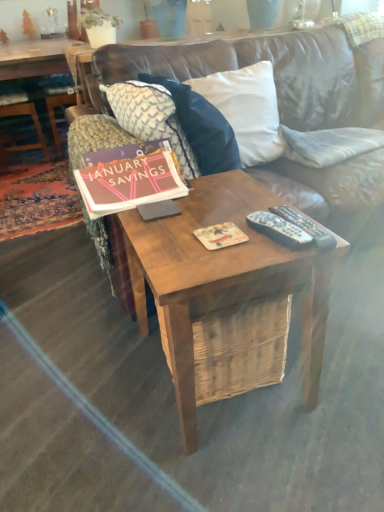
This screenshot has width=384, height=512. What do you see at coordinates (240, 348) in the screenshot?
I see `woven brown basket at center` at bounding box center [240, 348].

Image resolution: width=384 pixels, height=512 pixels. Find the location of `patterned fabric pillow at center, positioned as the third pillow in right-to-left order`. patterned fabric pillow at center, positioned as the third pillow in right-to-left order is located at coordinates (151, 117).

You are a GUI agent. You are given a task and a screenshot of the screen. Output one action in this format:
    pyautogui.click(x=<x>, y=<y>)
    Task: Click on the white matte pot at upper left
    The image size is (384, 512).
    Given the screenshot: What is the action you would take?
    pyautogui.click(x=99, y=26)

What is the approximate height of brown leather couch at center?

brown leather couch at center is 34.80 inches in height.

Measure the distance between matte pink paper at center and camera.

matte pink paper at center is 1.14 meters from camera.

What do you see at coordinates (278, 229) in the screenshot? I see `black plastic remote controls at center, placed as the 1th remote control when sorted from left to right` at bounding box center [278, 229].

What are the coordinates of `black plastic remote controls at center, the 2th remote control from the left` in the screenshot? It's located at (305, 226).

This screenshot has height=512, width=384. What do you see at coordinates (222, 277) in the screenshot? I see `wooden table at center` at bounding box center [222, 277].

Identify the location of woven brown basket at center. This screenshot has width=384, height=512. (240, 348).

Is there a large distance between black plastic remote controls at center, the 2th remote control from the left, and woven brown basket at center?

No, black plastic remote controls at center, the 2th remote control from the left, is not far from woven brown basket at center.

From a real-world perspective, who is located higher, black plastic remote controls at center, arranged as the 1th remote control when viewed from the right, or woven brown basket at center?

black plastic remote controls at center, arranged as the 1th remote control when viewed from the right, from a real-world perspective.

Is black plastic remote controls at center, the 2th remote control from the left, to the left of woven brown basket at center from the viewer's perspective?

Incorrect, black plastic remote controls at center, the 2th remote control from the left, is not on the left side of woven brown basket at center.

Does black plastic remote controls at center, the 2th remote control from the left, have a lesser width compared to woven brown basket at center?

Yes, black plastic remote controls at center, the 2th remote control from the left, is thinner than woven brown basket at center.

Does wooden table at center touch patterned fabric pillow at center, positioned as the third pillow in right-to-left order?

There is a gap between wooden table at center and patterned fabric pillow at center, positioned as the third pillow in right-to-left order.

Is wooden table at center bigger or smaller than patterned fabric pillow at center, the first pillow in the left-to-right sequence?

Considering their sizes, wooden table at center takes up more space than patterned fabric pillow at center, the first pillow in the left-to-right sequence.

Considering the positions of points (310, 317) and (154, 109), is point (310, 317) farther from camera compared to point (154, 109)?

That is False.

Is white fabric pillow at upper center, which appears as the 2th pillow when viewed from the left, positioned far away from woodenwoodencoffee table at left?

That's right, there is a large distance between white fabric pillow at upper center, which appears as the 2th pillow when viewed from the left, and woodenwoodencoffee table at left.

Is white fabric pillow at upper center, which appears as the 2th pillow when viewed from the left, at the right side of woodenwoodencoffee table at left?

Indeed, white fabric pillow at upper center, which appears as the 2th pillow when viewed from the left, is positioned on the right side of woodenwoodencoffee table at left.

Locate an element on the screen. This screenshot has width=384, height=512. coffee table on the left of white fabric pillow at upper center, which appears as the 2th pillow when viewed from the left is located at coordinates (36, 57).

Considering the sizes of objects white fabric pillow at upper center, the 2th pillow when ordered from right to left, and woodenwoodencoffee table at left in the image provided, who is taller, white fabric pillow at upper center, the 2th pillow when ordered from right to left, or woodenwoodencoffee table at left?

woodenwoodencoffee table at left.

I want to click on the 3rd pillow above the black plastic remote controls at center, placed as the 1th remote control when sorted from left to right (from the image's perspective), so click(246, 109).

Is white fabric pillow at upper center, the 2th pillow when ordered from right to left, taller or shorter than black plastic remote controls at center, placed as the 1th remote control when sorted from left to right?

Clearly, white fabric pillow at upper center, the 2th pillow when ordered from right to left, is taller compared to black plastic remote controls at center, placed as the 1th remote control when sorted from left to right.

Which is in front, white fabric pillow at upper center, the 2th pillow when ordered from right to left, or black plastic remote controls at center, which ranks as the second remote control in right-to-left order?

black plastic remote controls at center, which ranks as the second remote control in right-to-left order, is more forward.

Is black plastic remote controls at center, placed as the 1th remote control when sorted from left to right, at the back of white fabric pillow at upper center, which appears as the 2th pillow when viewed from the left?

That's not correct — white fabric pillow at upper center, which appears as the 2th pillow when viewed from the left, is not looking away from black plastic remote controls at center, placed as the 1th remote control when sorted from left to right.

Would you consider woodenwoodencoffee table at left to be distant from white fabric pillow at upper right, the third pillow in the left-to-right sequence?

Yes, woodenwoodencoffee table at left is far from white fabric pillow at upper right, the third pillow in the left-to-right sequence.

How distant is woodenwoodencoffee table at left from white fabric pillow at upper right, the third pillow in the left-to-right sequence?

woodenwoodencoffee table at left and white fabric pillow at upper right, the third pillow in the left-to-right sequence, are 6.41 feet apart.

Does woodenwoodencoffee table at left have a greater width compared to white fabric pillow at upper right, the 1th pillow viewed from the right?

Yes, woodenwoodencoffee table at left is wider than white fabric pillow at upper right, the 1th pillow viewed from the right.

Is woodenwoodencoffee table at left oriented towards white fabric pillow at upper right, the 1th pillow viewed from the right?

No, woodenwoodencoffee table at left is not aimed at white fabric pillow at upper right, the 1th pillow viewed from the right.

Can you see white matte pot at upper left touching white fabric pillow at upper center, the 2th pillow when ordered from right to left?

white matte pot at upper left is not next to white fabric pillow at upper center, the 2th pillow when ordered from right to left, and they're not touching.

Consider the image. Is white fabric pillow at upper center, which appears as the 2th pillow when viewed from the left, inside white matte pot at upper left?

→ No, white fabric pillow at upper center, which appears as the 2th pillow when viewed from the left, is located outside of white matte pot at upper left.

From the image's perspective, which one is positioned lower, white matte pot at upper left or white fabric pillow at upper center, which appears as the 2th pillow when viewed from the left?

white fabric pillow at upper center, which appears as the 2th pillow when viewed from the left, appears lower in the image.

From a real-world perspective, which is physically above, white matte pot at upper left or white fabric pillow at upper center, the 2th pillow when ordered from right to left?

In real-world perspective, white matte pot at upper left is above.

Is point (9, 114) more distant than point (277, 110)?

Yes, it is.

Which object is further away from the camera, woodenwoodencoffee table at left or brown leather couch at center?

Positioned behind is woodenwoodencoffee table at left.

Do you think woodenwoodencoffee table at left is within brown leather couch at center, or outside of it?

woodenwoodencoffee table at left is spatially situated outside brown leather couch at center.

Can you confirm if woodenwoodencoffee table at left is bigger than brown leather couch at center?

No, woodenwoodencoffee table at left is not bigger than brown leather couch at center.

There is a woven brown basket at center. Where is `the 2nd remote control above it (from the image's perspective)`? This screenshot has height=512, width=384. the 2nd remote control above it (from the image's perspective) is located at coordinates (305, 226).

Locate an element on the screen. table below the patterned fabric pillow at center, the first pillow in the left-to-right sequence (from the image's perspective) is located at coordinates (222, 277).

Based on their spatial positions, is patterned fabric pillow at center, the first pillow in the left-to-right sequence, or white fabric pillow at upper right, the third pillow in the left-to-right sequence, further from matte pink paper at center?

white fabric pillow at upper right, the third pillow in the left-to-right sequence.

Which object lies further to the anchor point wooden table at center, woven brown basket at center or white fabric pillow at upper center, which appears as the 2th pillow when viewed from the left?

white fabric pillow at upper center, which appears as the 2th pillow when viewed from the left.

When comparing their distances from brown leather couch at center, does woven brown basket at center or black plastic remote controls at center, placed as the 1th remote control when sorted from left to right, seem further?

black plastic remote controls at center, placed as the 1th remote control when sorted from left to right, is further to brown leather couch at center.

When comparing their distances from white matte pot at upper left, does woodenwoodencoffee table at left or patterned fabric pillow at center, the first pillow in the left-to-right sequence, seem further?

woodenwoodencoffee table at left lies further to white matte pot at upper left than the other object.

When comparing their distances from woven brown basket at center, does white fabric pillow at upper center, which appears as the 2th pillow when viewed from the left, or matte pink paper at center seem further?

white fabric pillow at upper center, which appears as the 2th pillow when viewed from the left, lies further to woven brown basket at center than the other object.

When comparing their distances from matte pink paper at center, does matte cardboard magazine at center or woodenwoodencoffee table at left seem further?

woodenwoodencoffee table at left lies further to matte pink paper at center than the other object.

Based on their spatial positions, is woodenwoodencoffee table at left or white matte pot at upper left closer to patterned fabric pillow at center, the first pillow in the left-to-right sequence?

Based on the image, white matte pot at upper left appears to be nearer to patterned fabric pillow at center, the first pillow in the left-to-right sequence.

In the scene shown: Which object lies nearer to the anchor point patterned fabric pillow at center, positioned as the third pillow in right-to-left order, wooden table at center or woven brown basket at center?

Based on the image, wooden table at center appears to be nearer to patterned fabric pillow at center, positioned as the third pillow in right-to-left order.

Locate an element on the screen. The image size is (384, 512). book between white matte pot at upper left and black plastic remote controls at center, which ranks as the second remote control in right-to-left order, vertically is located at coordinates point(130,177).

Locate an element on the screen. The width and height of the screenshot is (384, 512). studio couch between white matte pot at upper left and white fabric pillow at upper right, the third pillow in the left-to-right sequence is located at coordinates (275, 70).

At what (x,y) coordinates should I click in order to perform the action: click on basket between woodenwoodencoffee table at left and white fabric pillow at upper right, the 1th pillow viewed from the right, from left to right. Please return your answer as a coordinate pair (x, y). The image size is (384, 512). Looking at the image, I should click on (240, 348).

At what (x,y) coordinates should I click in order to perform the action: click on table between matte pink paper at center and white fabric pillow at upper right, the 1th pillow viewed from the right. Please return your answer as a coordinate pair (x, y). The height and width of the screenshot is (512, 384). Looking at the image, I should click on (222, 277).